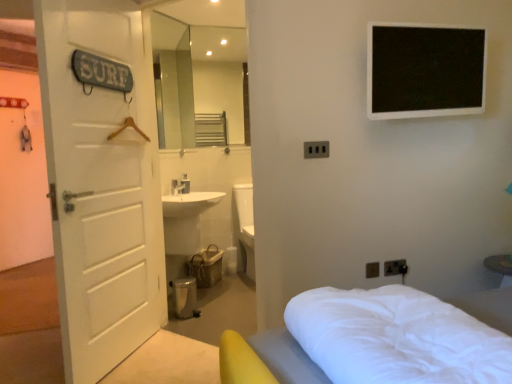
You are a GUI agent. You are given a task and a screenshot of the screen. Output one action in this format:
    pyautogui.click(x=<x>, y=<y>)
    Task: Click on the vacant area that lies to the right of white wooden door at left
    
    Given the screenshot: What is the action you would take?
    pyautogui.click(x=181, y=348)